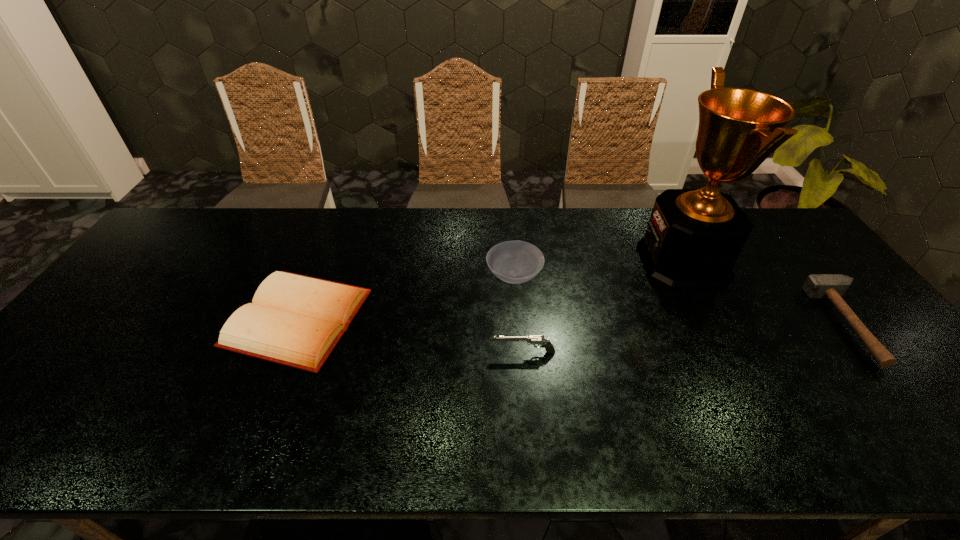
You are a GUI agent. You are given a task and a screenshot of the screen. Output one action in this format:
    pyautogui.click(x=<x>, y=<y>)
    Task: Click on the free area in between the rightmost object and the leftmost object
    Image resolution: width=960 pixels, height=540 pixels.
    Given the screenshot: What is the action you would take?
    pyautogui.click(x=574, y=321)

I want to click on free space between the bowl and the Bible, so click(x=406, y=298).

The height and width of the screenshot is (540, 960). In order to click on free space between the hammer and the bowl in this screenshot , I will do `click(683, 300)`.

This screenshot has width=960, height=540. Identify the location of empty space that is in between the trophy cup and the pistol. (603, 307).

You are a GUI agent. You are given a task and a screenshot of the screen. Output one action in this format:
    pyautogui.click(x=<x>, y=<y>)
    Task: Click on the vacant area that lies between the pistol and the bowl
    The image size is (960, 540).
    Given the screenshot: What is the action you would take?
    pyautogui.click(x=518, y=314)

At what (x,y) coordinates should I click in order to perform the action: click on object that ranks as the second closest to the Bible. Please return your answer as a coordinate pair (x, y). The image size is (960, 540). Looking at the image, I should click on (531, 340).

Locate an element on the screen. This screenshot has width=960, height=540. object that stands as the second closest to the bowl is located at coordinates (694, 236).

The image size is (960, 540). Identify the location of free space that satisfies the following two spatial constraints: 1. on the back side of the bowl; 2. on the right side of the Bible. (315, 276).

What are the coordinates of `free location that satisfies the following two spatial constraints: 1. on the front of the second object from right to left with the label; 2. on the front side of the bowl` in the screenshot? It's located at (690, 276).

Find the location of a particular element. The height and width of the screenshot is (540, 960). blank area in the image that satisfies the following two spatial constraints: 1. on the back side of the bowl; 2. on the left side of the leftmost object is located at coordinates (315, 276).